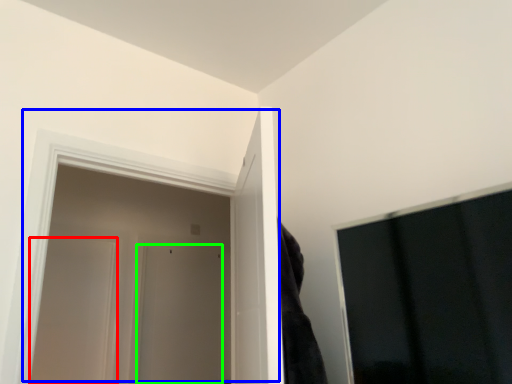
Question: Which object is the farthest from door (highlighted by a red box)? Choose among these: door (highlighted by a blue box) or door (highlighted by a green box).

Choices:
 (A) door
 (B) door

Answer: (A)